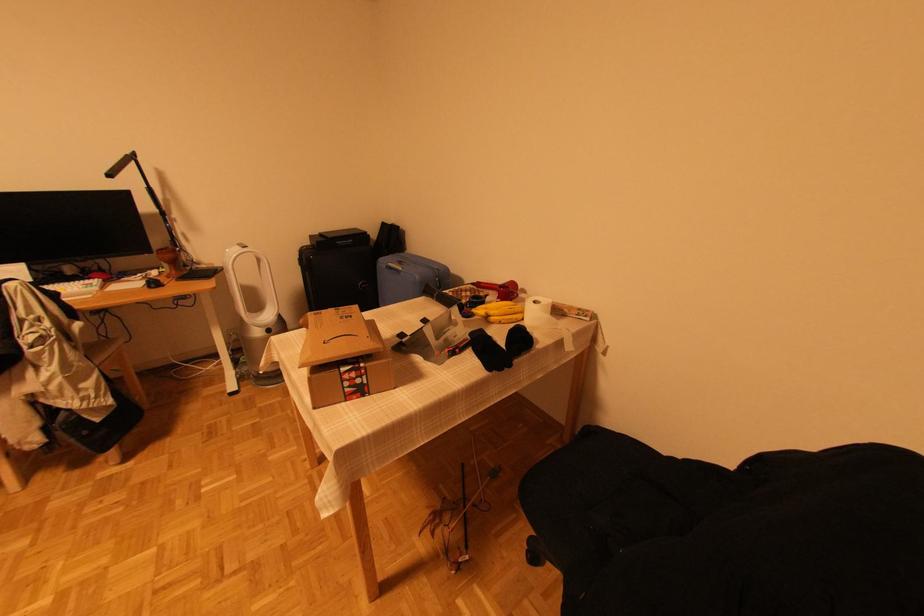
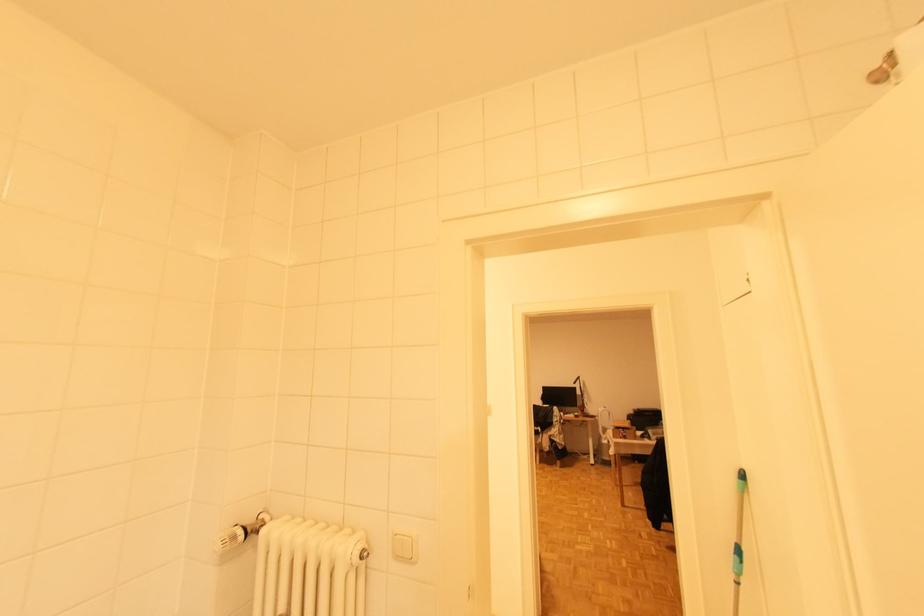
Question: I am providing you with two images of the same scene from different viewpoints. Which of the following objects are not visible in image2?

Choices:
 (A) radiator knob
 (B) blue ceramic mug
 (C) mop handle
 (D) red handled screwdriver

Answer: (D)